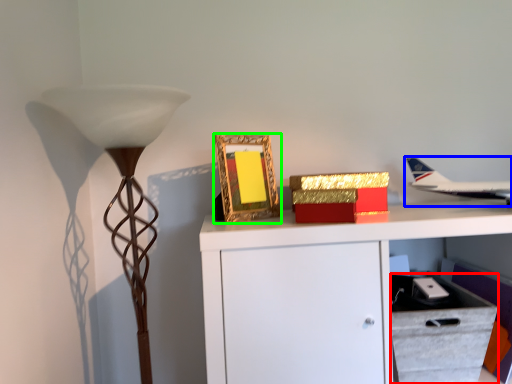
Question: Which is farther away from drawer (highlighted by a red box)? airplane (highlighted by a blue box) or picture frame (highlighted by a green box)?

Choices:
 (A) airplane
 (B) picture frame

Answer: (B)